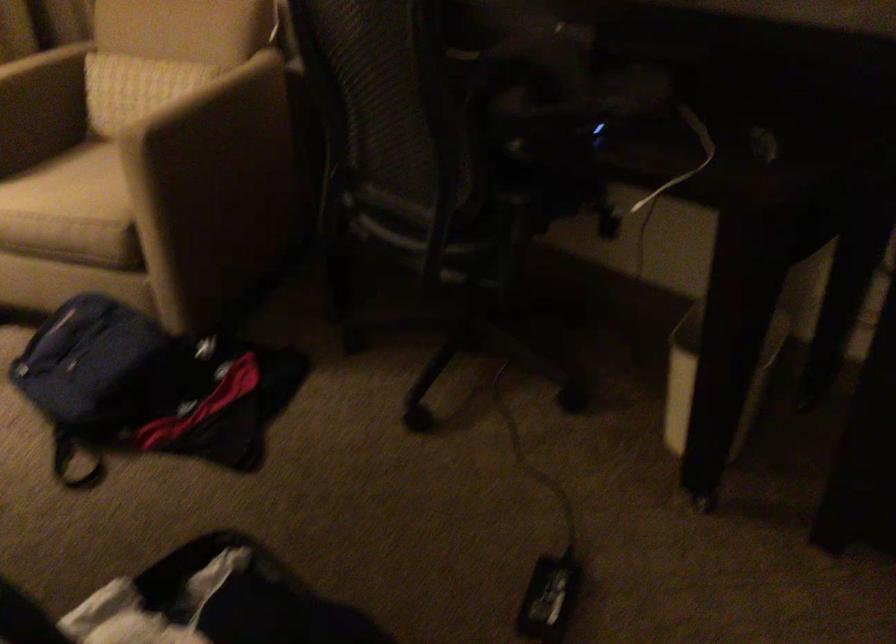
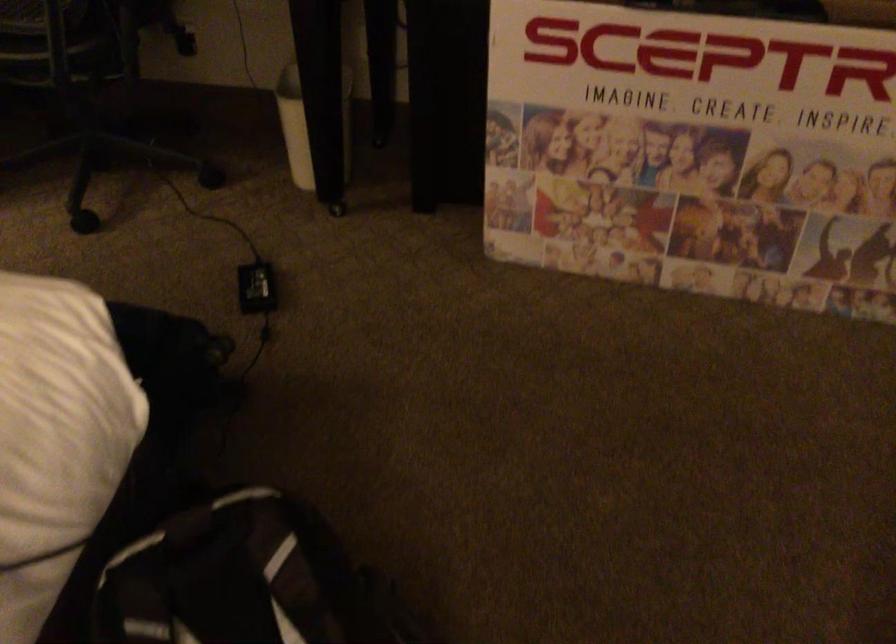
In the second image, find the point that corresponds to pixel 688 395 in the first image.

(306, 126)